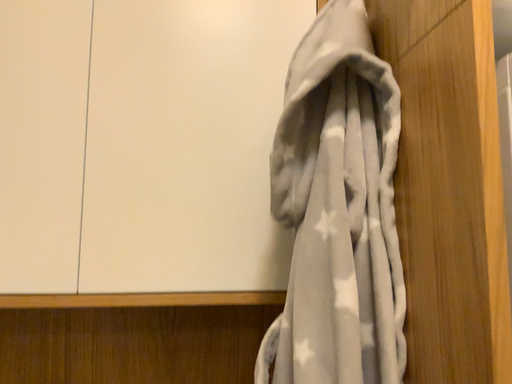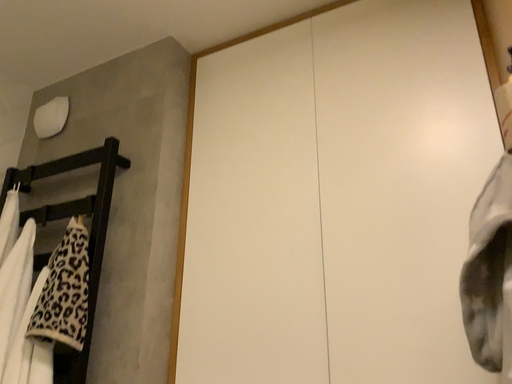
Question: How did the camera likely rotate when shooting the video?

Choices:
 (A) rotated downward
 (B) rotated upward

Answer: (B)